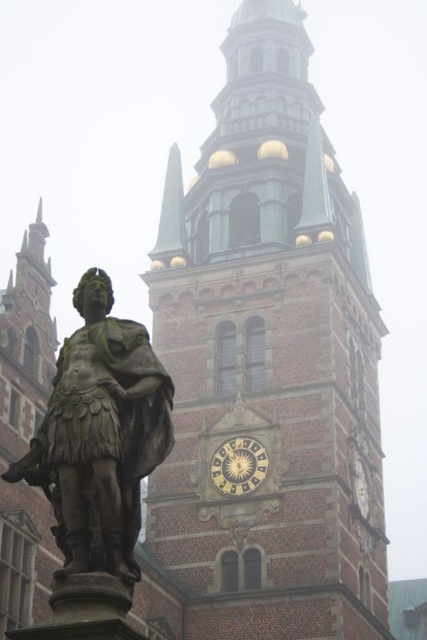
Question: Among these points, which one is farthest from the camera?

Choices:
 (A) (175, 204)
 (B) (266, 470)
 (C) (248, 620)
 (D) (125, 368)

Answer: (A)

Question: Where is brown brick tower at center located in relation to goldmetallicclock at center in the image?

Choices:
 (A) above
 (B) below

Answer: (A)

Question: Which object is closer to the camera taking this photo?

Choices:
 (A) bronze statue at center
 (B) goldmetallicclock at center
 (C) brown brick tower at center
 (D) green polished stone spire at upper center

Answer: (A)

Question: Is green polished stone spire at upper center behind goldmetallicclock at center?

Choices:
 (A) no
 (B) yes

Answer: (B)

Question: Is bronze statue at center positioned at the back of goldmetallicclock at center?

Choices:
 (A) no
 (B) yes

Answer: (A)

Question: Which of the following is the closest to the observer?

Choices:
 (A) green polished stone spire at upper center
 (B) brown brick tower at center
 (C) goldmetallicclock at center

Answer: (B)